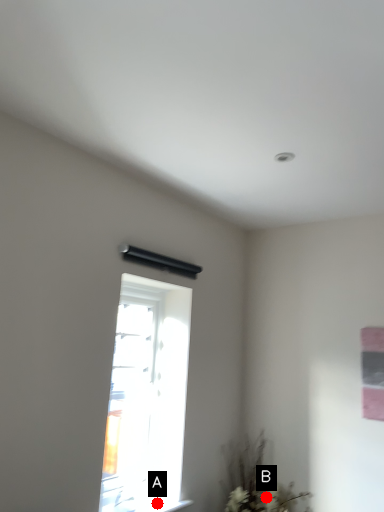
Question: Two points are circled on the image, labeled by A and B beside each circle. Which point appears farthest from the camera in this image?

Choices:
 (A) A is further
 (B) B is further

Answer: (B)